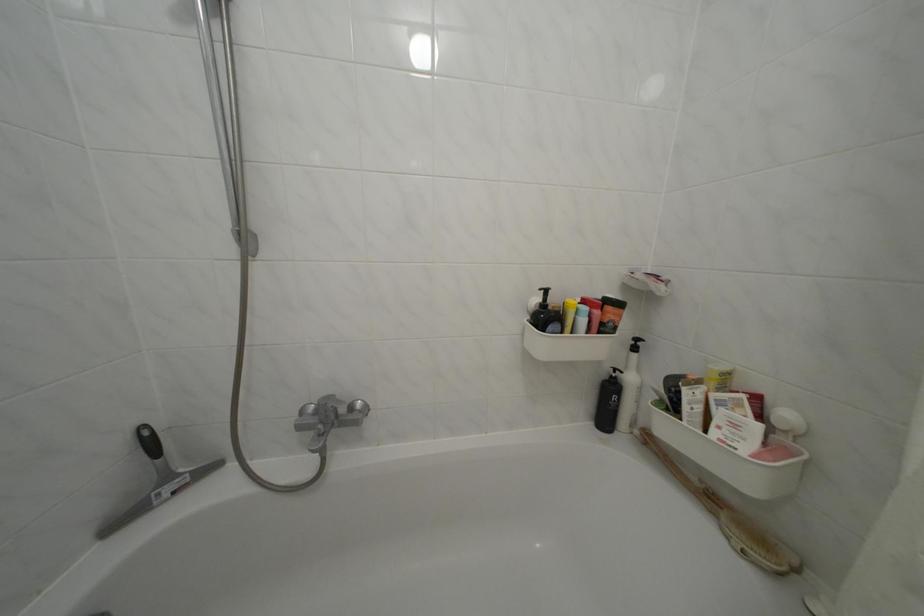
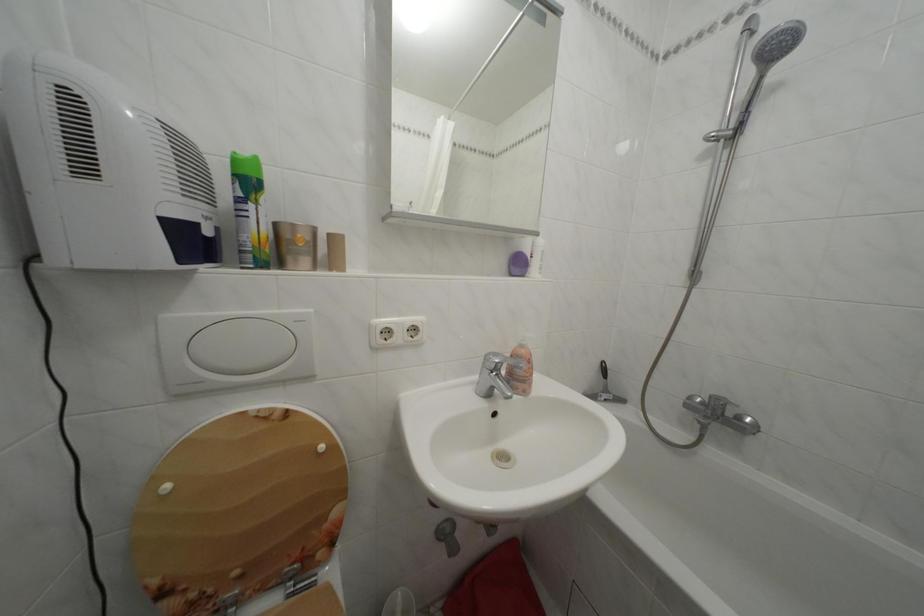
Question: Based on the continuous images, in which direction is the camera rotating? Reply with the corresponding letter.

Choices:
 (A) Left
 (B) Right
 (C) Up
 (D) Down

Answer: (A)